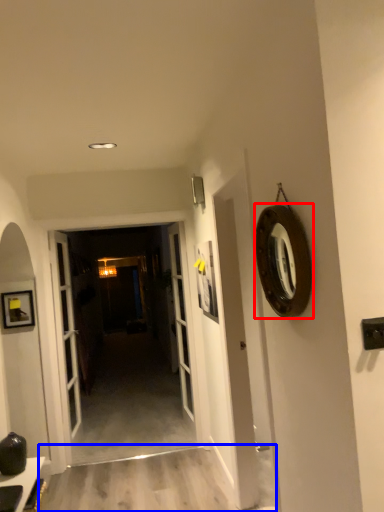
Question: Among these objects, which one is nearest to the camera, oval (highlighted by a red box) or path (highlighted by a blue box)?

Choices:
 (A) oval
 (B) path

Answer: (A)